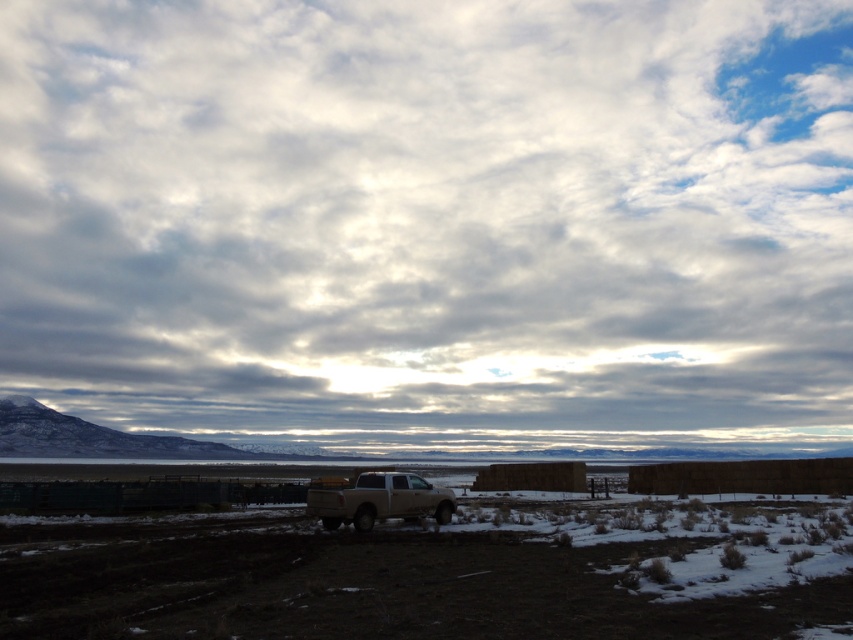
Looking at this image, between cloudy sky at upper center and matte white truck at center, which one is positioned higher?

cloudy sky at upper center is higher up.

Measure the distance between point (834,259) and camera.

Point (834,259) is 173.77 meters away from camera.

Find the location of a particular element. This screenshot has height=640, width=853. cloudy sky at upper center is located at coordinates (431, 220).

Can you confirm if cloudy sky at upper center is shorter than brown dirt field at center?

Incorrect, cloudy sky at upper center's height does not fall short of brown dirt field at center's.

Who is more forward, (817, 173) or (65, 625)?

Point (65, 625)

Where is `cloudy sky at upper center`? The width and height of the screenshot is (853, 640). cloudy sky at upper center is located at coordinates (431, 220).

Is brown dirt field at center in front of matte white truck at center?

That is True.

Can you confirm if brown dirt field at center is positioned above matte white truck at center?

Correct, brown dirt field at center is located above matte white truck at center.

Is point (274, 520) in front of point (349, 499)?

No, it is not.

You are a GUI agent. You are given a task and a screenshot of the screen. Output one action in this format:
    pyautogui.click(x=<x>, y=<y>)
    Task: Click on the brown dirt field at center
    
    Given the screenshot: What is the action you would take?
    pyautogui.click(x=434, y=576)